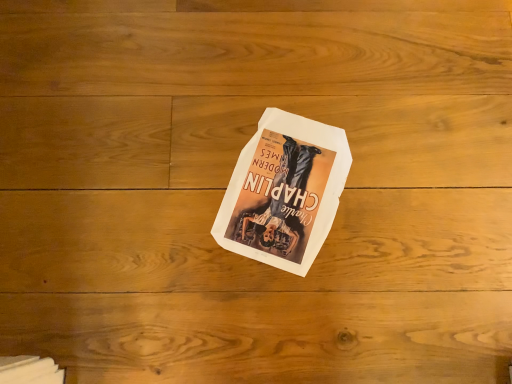
Locate an element on the screen. Image resolution: width=512 pixels, height=384 pixels. vacant location behind white paper at center is located at coordinates (279, 69).